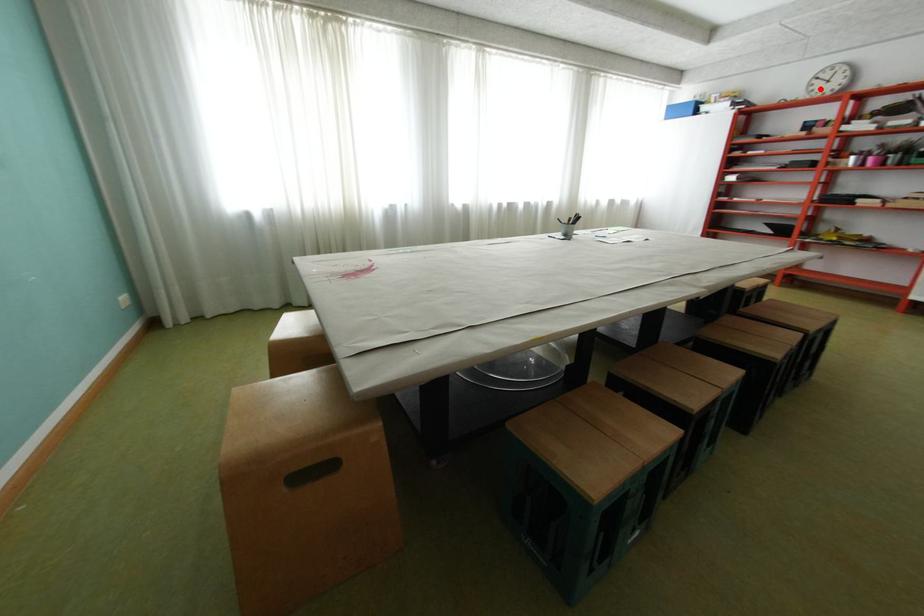
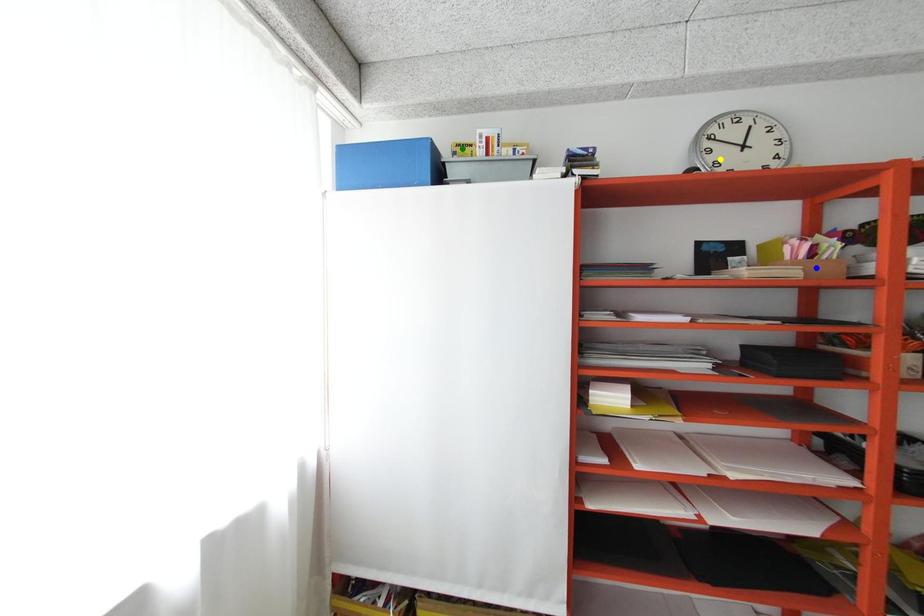
Question: I am providing you with two images of the same scene from different viewpoints. A red point is marked on the first image. You are given multiple points on the second image. Which point in image 2 represents the same 3d spot as the red point in image 1?

Choices:
 (A) blue point
 (B) green point
 (C) yellow point

Answer: (C)